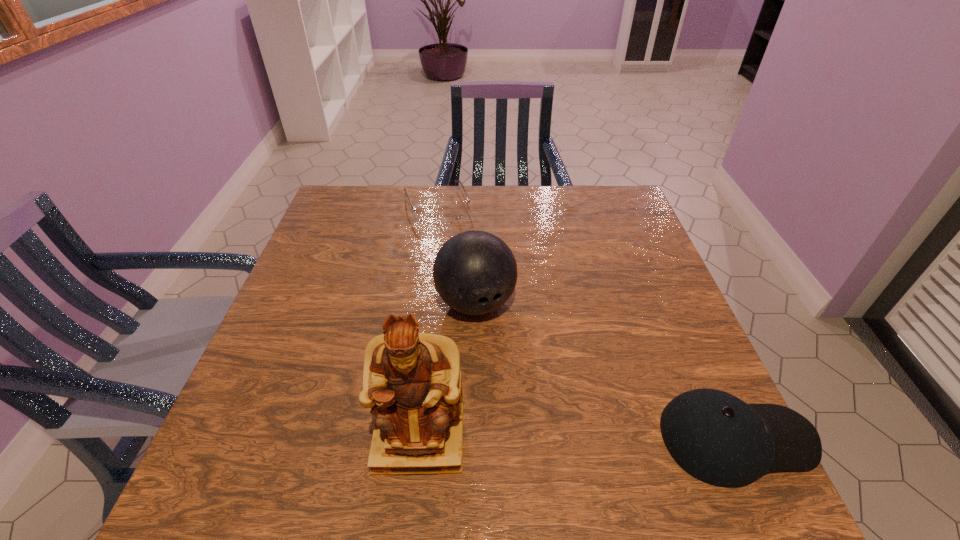
Locate an element on the screen. This screenshot has width=960, height=540. free location at the left edge is located at coordinates (274, 367).

In the image, there is a desktop. At what (x,y) coordinates should I click in order to perform the action: click on vacant space at the right edge. Please return your answer as a coordinate pair (x, y). Looking at the image, I should click on (644, 376).

Locate an element on the screen. This screenshot has height=540, width=960. vacant space at the far left corner of the desktop is located at coordinates (340, 212).

This screenshot has height=540, width=960. In the image, there is a desktop. What are the coordinates of `vacant space at the near left corner` in the screenshot? It's located at (271, 420).

Where is `vacant region at the far right corner of the desktop`? vacant region at the far right corner of the desktop is located at coordinates (598, 213).

The width and height of the screenshot is (960, 540). I want to click on free spot between the farthest object and the third tallest object, so click(586, 322).

At what (x,y) coordinates should I click in order to perform the action: click on free spot between the baseball cap and the shortest object. Please return your answer as a coordinate pair (x, y). This screenshot has width=960, height=540. Looking at the image, I should click on (586, 322).

Find the location of `vacant space that is in between the baseball cap and the shortest object`. vacant space that is in between the baseball cap and the shortest object is located at coordinates (586, 322).

The height and width of the screenshot is (540, 960). I want to click on free space between the farthest object and the figurine, so click(428, 322).

Where is `free area in between the spectacles and the baseball cap`? free area in between the spectacles and the baseball cap is located at coordinates (586, 322).